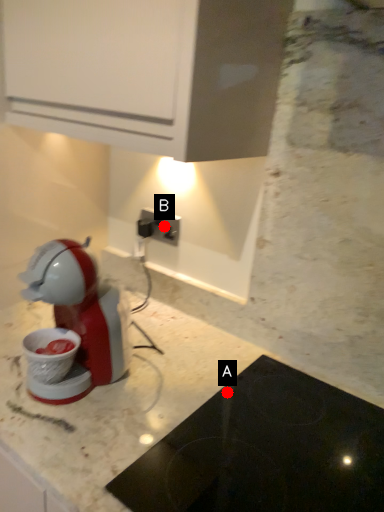
Question: Two points are circled on the image, labeled by A and B beside each circle. Which point appears closest to the camera in this image?

Choices:
 (A) A is closer
 (B) B is closer

Answer: (A)